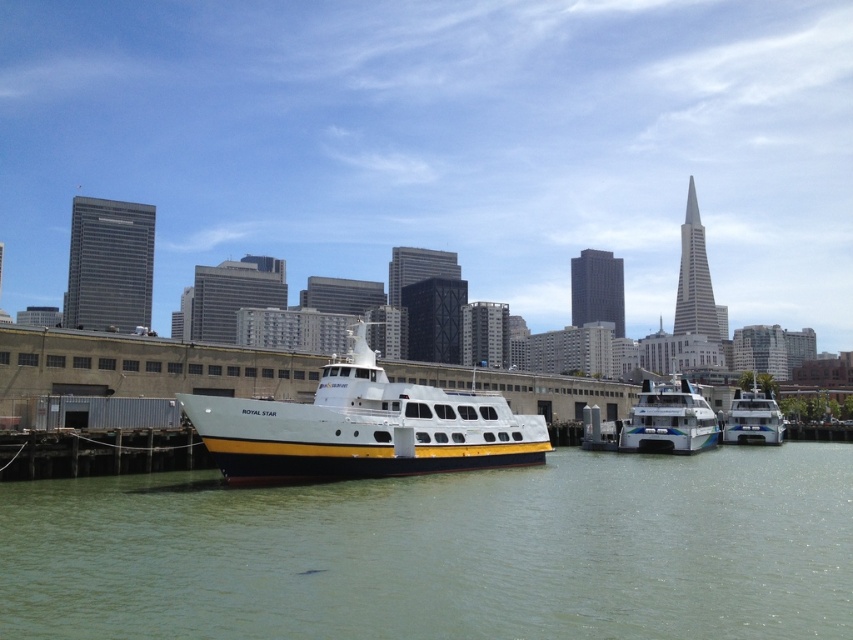
Who is positioned more to the right, white matte ferry at center or white glossy boat at center?

white glossy boat at center is more to the right.

Is white matte ferry at center taller than white glossy boat at center?

Yes.

Who is more distant from viewer, (405, 448) or (723, 440)?

Point (723, 440)

Locate an element on the screen. The height and width of the screenshot is (640, 853). white matte ferry at center is located at coordinates (363, 428).

Consider the image. Is white matte ferry at center to the left of white glossy ferry at center from the viewer's perspective?

Yes, white matte ferry at center is to the left of white glossy ferry at center.

Between point (289, 413) and point (674, 403), which one is positioned behind?

Point (674, 403)

You are a GUI agent. You are given a task and a screenshot of the screen. Output one action in this format:
    pyautogui.click(x=<x>, y=<y>)
    Task: Click on the white matte ferry at center
    
    Given the screenshot: What is the action you would take?
    pyautogui.click(x=363, y=428)

Locate an element on the screen. Image resolution: width=853 pixels, height=640 pixels. white matte ferry at center is located at coordinates (363, 428).

Who is more distant from viewer, [701,412] or [767,401]?

Point [767,401]

Can you confirm if white glossy ferry at center is positioned below white glossy boat at center?

No, white glossy ferry at center is not below white glossy boat at center.

What do you see at coordinates (669, 420) in the screenshot? Image resolution: width=853 pixels, height=640 pixels. I see `white glossy ferry at center` at bounding box center [669, 420].

Locate an element on the screen. Image resolution: width=853 pixels, height=640 pixels. white glossy ferry at center is located at coordinates (669, 420).